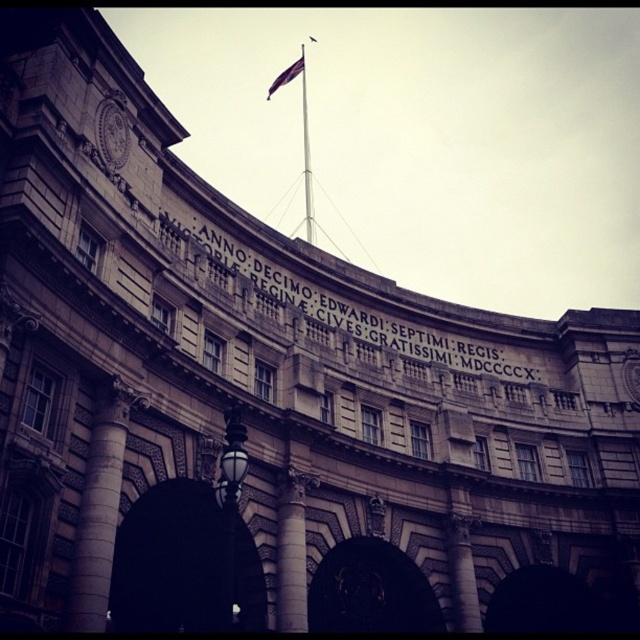
You are standing in front of the grand building and notice both the stone column at center and the silky purple flag at center. Which object is positioned closer to you?

The stone column at center is closer to the viewer than the silky purple flag at center.